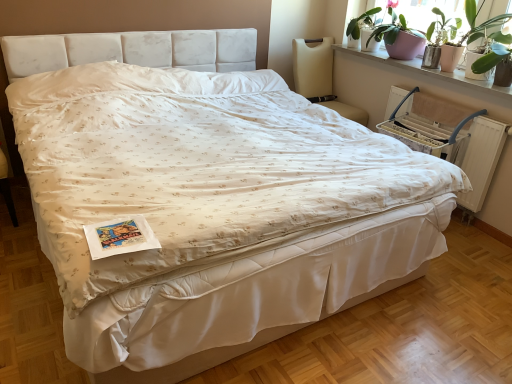
Question: Looking at their shapes, would you say green leafy plant at upper right is wider or thinner than beige fabric chair at upper right?

Choices:
 (A) thin
 (B) wide

Answer: (A)

Question: From a real-world perspective, is green leafy plant at upper right positioned above or below beige fabric chair at upper right?

Choices:
 (A) below
 (B) above

Answer: (B)

Question: Estimate the real-world distances between objects in this image. Which object is closer to the matte white window screen at upper right?

Choices:
 (A) green leafy plant at upper right
 (B) matte white window sill at upper right
 (C) beige fabric chair at upper right

Answer: (A)

Question: Estimate the real-world distances between objects in this image. Which object is farther from the matte white window sill at upper right?

Choices:
 (A) beige fabric chair at upper right
 (B) green leafy plant at upper right
 (C) matte white window screen at upper right

Answer: (A)